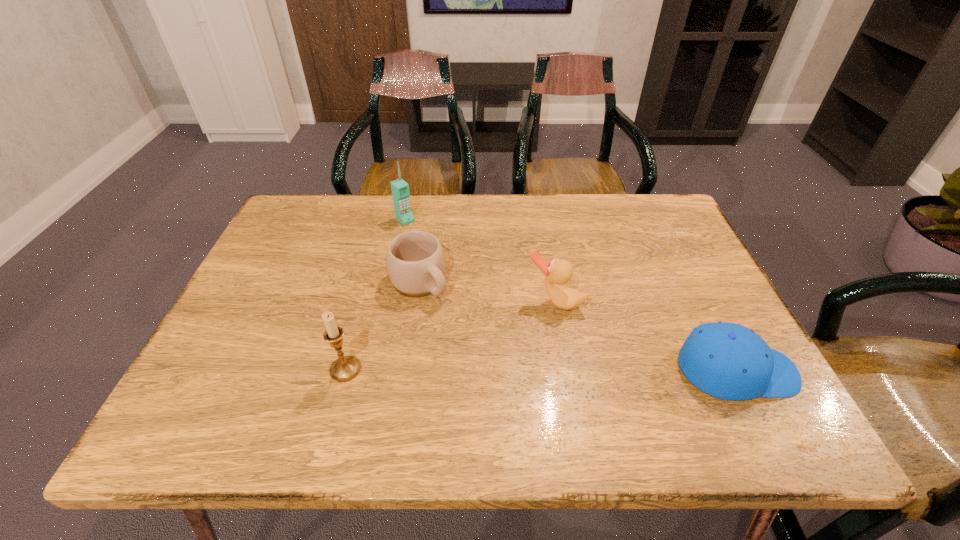
Identify the location of candle holder. (345, 368).

Where is `the rightmost object`? the rightmost object is located at coordinates (729, 361).

Image resolution: width=960 pixels, height=540 pixels. In order to click on the second object from right to left in this screenshot , I will do `click(557, 271)`.

In order to click on cellular telephone in this screenshot , I will do `click(400, 189)`.

This screenshot has height=540, width=960. I want to click on mug, so click(x=415, y=260).

The image size is (960, 540). I want to click on free region located 0.230m on the right of the candle holder, so click(471, 369).

You are a GUI agent. You are given a task and a screenshot of the screen. Output one action in this format:
    pyautogui.click(x=<x>, y=<y>)
    Task: Click on the vacant area located 0.140m on the beak of the duck
    The image size is (960, 540).
    Given the screenshot: What is the action you would take?
    pyautogui.click(x=523, y=359)

Identify the location of vacant region located 0.080m on the beak of the duck. The image size is (960, 540). (534, 339).

Identify the location of free space located on the beak of the duck. The image size is (960, 540). (518, 369).

The image size is (960, 540). Identify the location of free point located on the keypad of the farthest object. (438, 251).